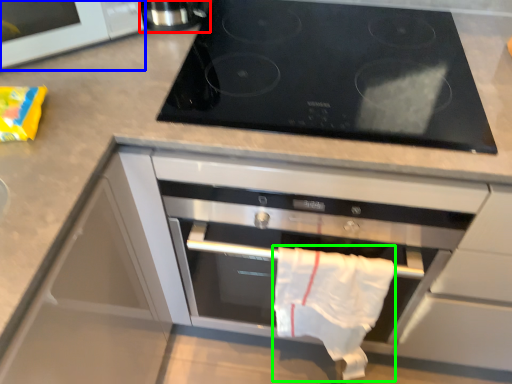
Question: Estimate the real-world distances between objects in this image. Which object is closer to appliance (highlighted by a red box), microwave (highlighted by a blue box) or cloth (highlighted by a green box)?

Choices:
 (A) microwave
 (B) cloth

Answer: (A)